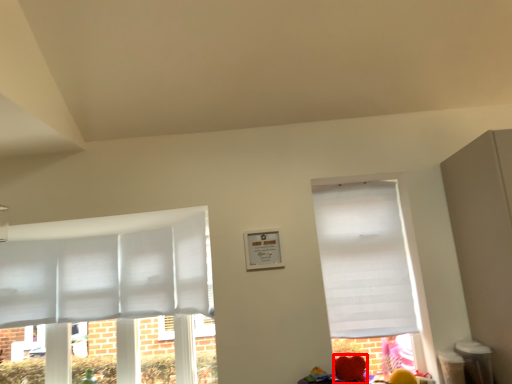
Question: From the image's perspective, where is flower (annotated by the red box) located in relation to window in the image?

Choices:
 (A) above
 (B) below

Answer: (B)